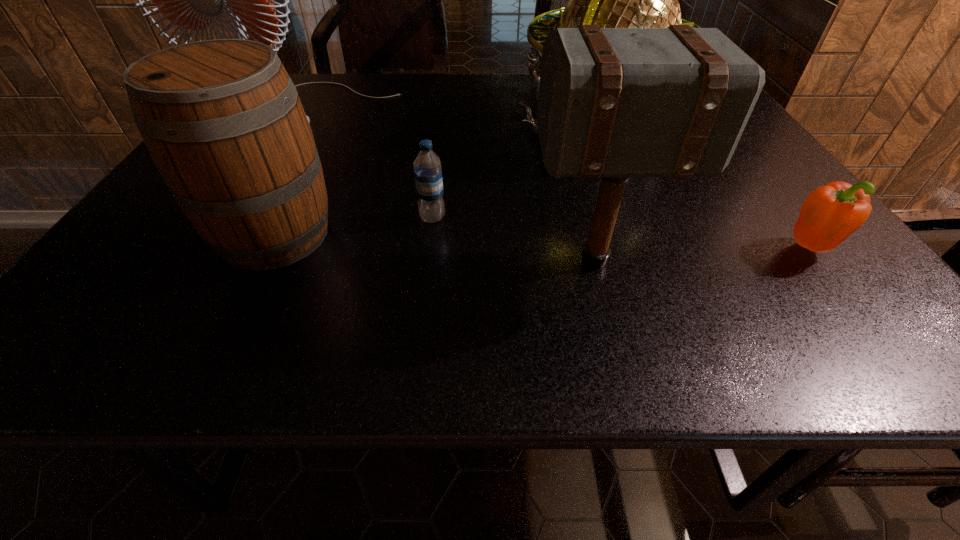
The height and width of the screenshot is (540, 960). Identify the location of object positioned at the far left corner. (192, 0).

At what (x,y) coordinates should I click in order to perform the action: click on object that is positioned at the far right corner. Please return your answer as a coordinate pair (x, y). Looking at the image, I should click on (613, 0).

At what (x,y) coordinates should I click in order to perform the action: click on free space at the far edge of the desktop. Please return your answer as a coordinate pair (x, y). Looking at the image, I should click on (414, 104).

At what (x,y) coordinates should I click in order to perform the action: click on free space at the near edge of the desktop. Please return your answer as a coordinate pair (x, y). This screenshot has height=540, width=960. Looking at the image, I should click on (197, 320).

Image resolution: width=960 pixels, height=540 pixels. Identify the location of free space at the left edge of the desktop. (154, 211).

This screenshot has height=540, width=960. I want to click on free space at the far left corner of the desktop, so click(307, 80).

In the image, there is a desktop. Where is `vacant space at the near right corner`? The height and width of the screenshot is (540, 960). vacant space at the near right corner is located at coordinates (876, 329).

You are a GUI agent. You are given a task and a screenshot of the screen. Output one action in this format:
    pyautogui.click(x=<x>, y=<y>)
    Task: Click on the vacant space that's between the pepper and the mallet
    This screenshot has width=960, height=540.
    Given the screenshot: What is the action you would take?
    pyautogui.click(x=703, y=254)

You are a GUI agent. You are given a task and a screenshot of the screen. Output one action in this format:
    pyautogui.click(x=<x>, y=<y>)
    Task: Click on the vacant space in between the cider and the mallet
    The height and width of the screenshot is (540, 960).
    Given the screenshot: What is the action you would take?
    pyautogui.click(x=435, y=247)

Image resolution: width=960 pixels, height=540 pixels. I want to click on free spot between the pepper and the water bottle, so click(621, 232).